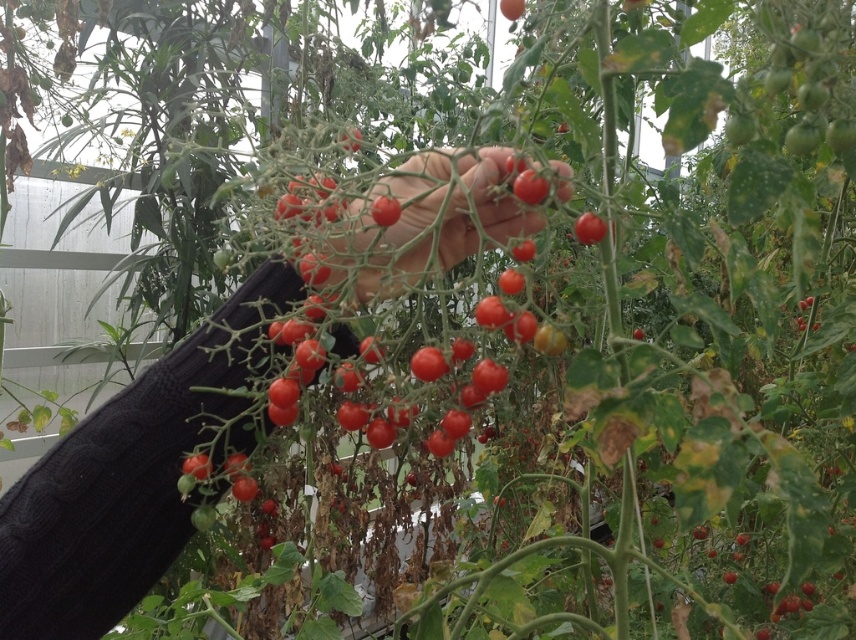
Is cable-knit sweater at center positioned behind smooth skin hand at center?

That is True.

How distant is cable-knit sweater at center from smooth skin hand at center?

cable-knit sweater at center is 8.90 centimeters from smooth skin hand at center.

Who is more forward, (280, 282) or (458, 225)?

Point (458, 225) is more forward.

Locate an element on the screen. This screenshot has width=856, height=640. cable-knit sweater at center is located at coordinates (110, 499).

Between smooth skin hand at center and glossy red tomato at center, which one is positioned higher?

smooth skin hand at center is above.

Measure the distance between point (428, 259) and camera.

17.91 inches

Does point (403, 225) lie behind point (587, 212)?

Yes, it is.

You are a GUI agent. You are given a task and a screenshot of the screen. Output one action in this format:
    pyautogui.click(x=<x>, y=<y>)
    Task: Click on the smooth skin hand at center
    The width and height of the screenshot is (856, 640).
    Given the screenshot: What is the action you would take?
    pyautogui.click(x=431, y=220)

Looking at this image, who is positioned more to the right, cable-knit sweater at center or glossy red tomato at center?

glossy red tomato at center is more to the right.

Is cable-knit sweater at center bigger than glossy red tomato at center?

Yes, cable-knit sweater at center is bigger than glossy red tomato at center.

Which is in front, point (159, 432) or point (593, 228)?

Point (593, 228)

Find the location of a particular element. Image resolution: width=856 pixels, height=640 pixels. cable-knit sweater at center is located at coordinates (110, 499).